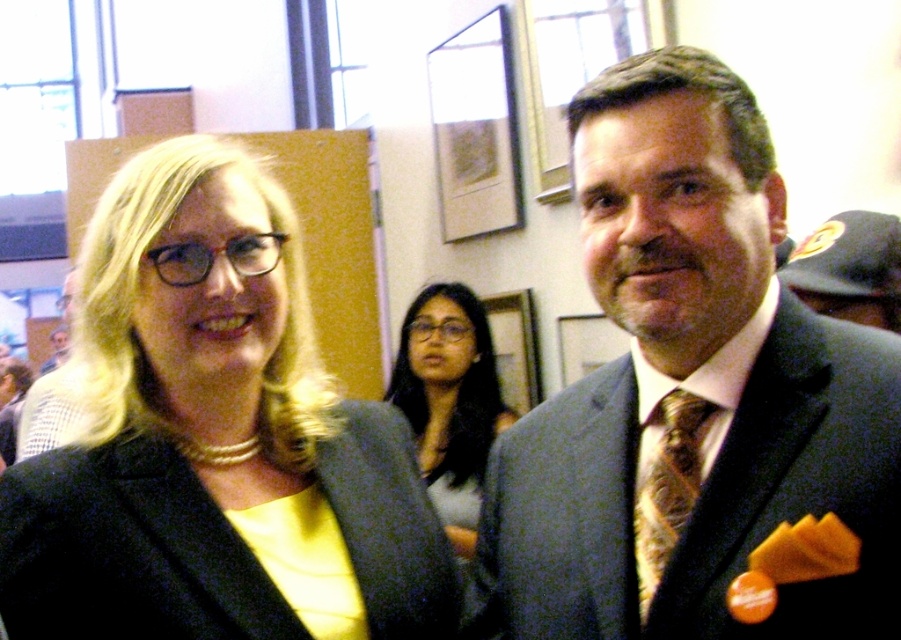
Question: Can you confirm if dark blue suit at center is positioned to the right of matte black suit at center?

Choices:
 (A) no
 (B) yes

Answer: (B)

Question: Can you confirm if black wool blazer at center is positioned below gold textured tie at center?

Choices:
 (A) no
 (B) yes

Answer: (B)

Question: Can you confirm if dark blue suit at center is positioned to the left of gold textured tie at center?

Choices:
 (A) no
 (B) yes

Answer: (A)

Question: Which of the following is the farthest from the observer?

Choices:
 (A) matte black suit at center
 (B) matte gray suit at center
 (C) dark blue suit at center
 (D) black wool blazer at center

Answer: (A)

Question: Which point is farther to the camera?

Choices:
 (A) (485, 451)
 (B) (872, 260)
 (C) (676, 442)

Answer: (A)

Question: Among these objects, which one is farthest from the camera?

Choices:
 (A) matte black blazer at center
 (B) gold textured tie at center

Answer: (A)